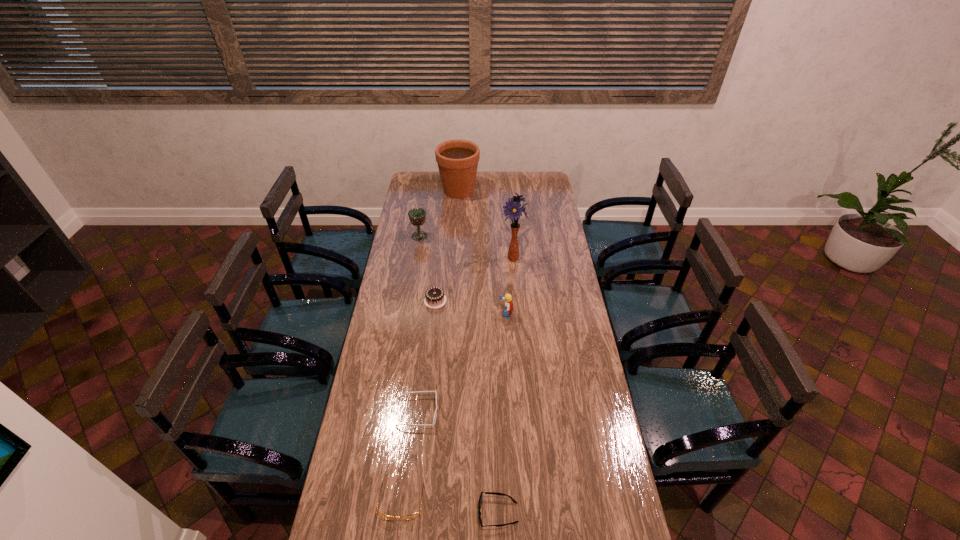
Identify the location of free spot between the fifth shortest object and the chocolate cake. (470, 307).

Find the location of a particular element. Image resolution: width=960 pixels, height=540 pixels. blank region between the seventh shortest object and the fourth shortest object is located at coordinates (447, 246).

Locate an element on the screen. Image resolution: width=960 pixels, height=540 pixels. vacant space in between the tallest object and the left sunglasses is located at coordinates (466, 335).

Point out which object is positioned as the seventh nearest to the chalice. Please provide its 2D coordinates. Your answer should be formatted as a tuple, i.e. [(x, y)], where the tuple contains the x and y coordinates of a point satisfying the conditions above.

[(494, 493)]

Locate an element on the screen. object identified as the seventh closest to the Lego is located at coordinates (457, 160).